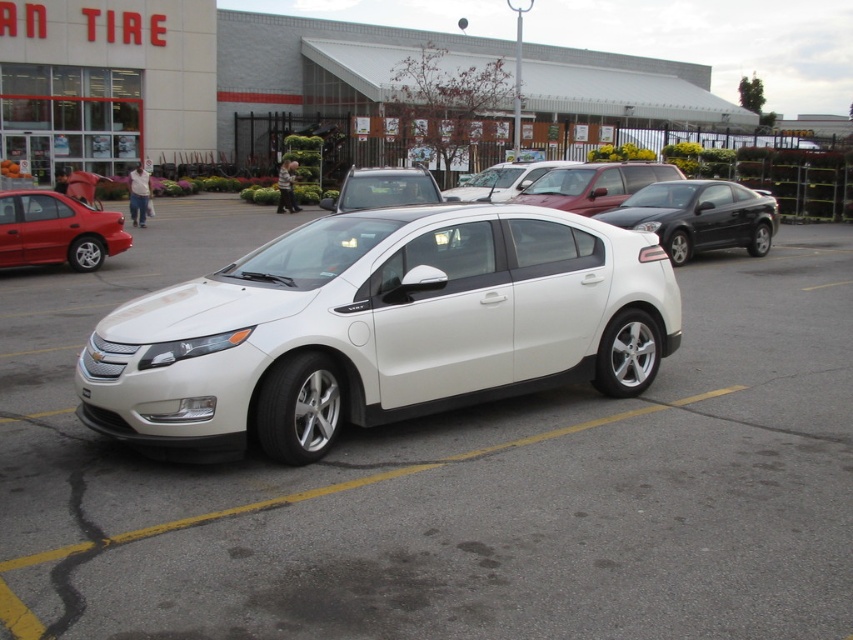
You are standing at the entrance of the tire store. You see a point marked at coordinates (451, 481). What object is located at that point?

The white metallic car at center is located at point (451, 481).

You are a customer at the TIRE store and want to park your car in the parking lot. You see two cars in the center area, a white metallic car at center and a white glossy sedan at center. Which one is positioned to the left side?

The white metallic car at center is positioned to the left of the white glossy sedan at center.